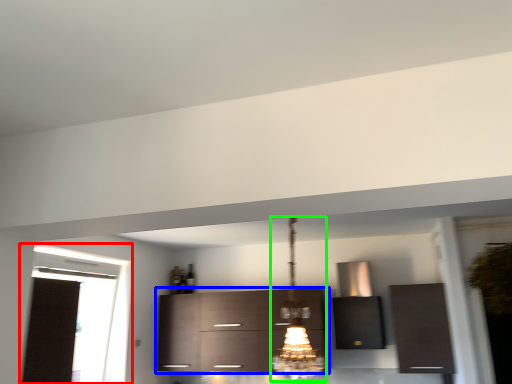
Question: Which object is positioned closest to window (highlighted by a red box)? Select from cabinetry (highlighted by a blue box) and light fixture (highlighted by a green box).

Choices:
 (A) cabinetry
 (B) light fixture

Answer: (A)